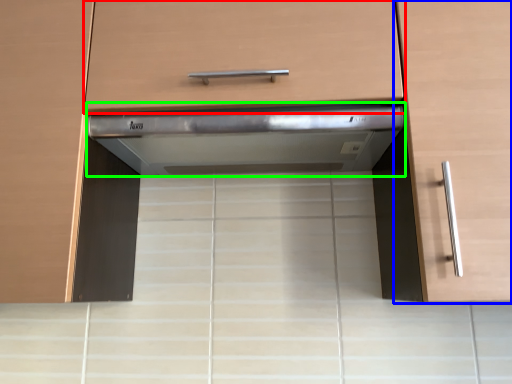
Question: Which is farther away from drawer (highlighted by a red box)? cabinetry (highlighted by a blue box) or home appliance (highlighted by a green box)?

Choices:
 (A) cabinetry
 (B) home appliance

Answer: (A)